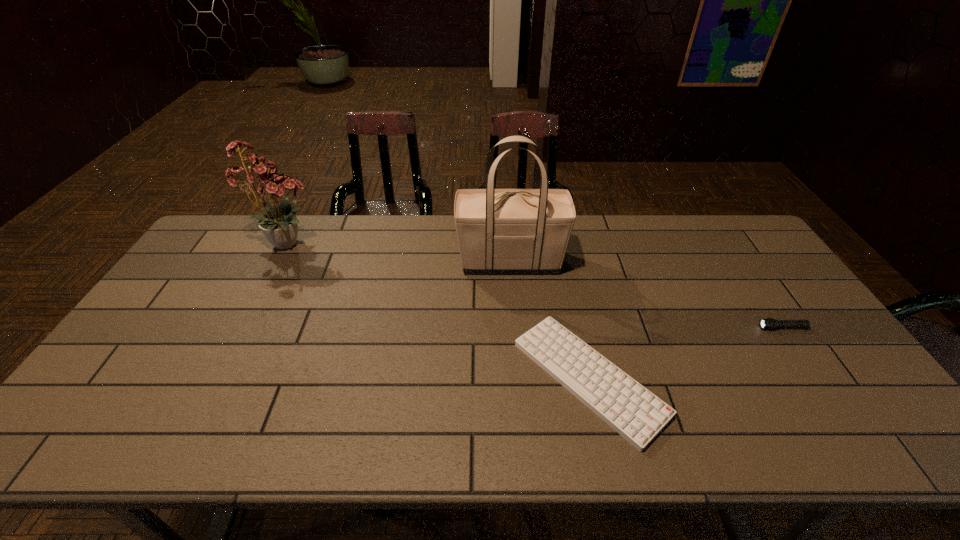
Find the location of a particular element. The width and height of the screenshot is (960, 540). empty location between the shopping bag and the rightmost object is located at coordinates (646, 295).

Locate an element on the screen. This screenshot has width=960, height=540. vacant space in between the computer keyboard and the flower arrangement is located at coordinates (440, 310).

You are a GUI agent. You are given a task and a screenshot of the screen. Output one action in this format:
    pyautogui.click(x=<x>, y=<y>)
    Task: Click on the free space between the computer keyboard and the rightmost object
    The width and height of the screenshot is (960, 540).
    Given the screenshot: What is the action you would take?
    pyautogui.click(x=685, y=353)

The width and height of the screenshot is (960, 540). I want to click on vacant point located between the leftmost object and the computer keyboard, so click(440, 310).

Identify which object is located as the second nearest to the flashlight. Please provide its 2D coordinates. Your answer should be formatted as a tuple, i.e. [(x, y)], where the tuple contains the x and y coordinates of a point satisfying the conditions above.

[(500, 231)]

Select which object is the second closest to the computer keyboard. Please provide its 2D coordinates. Your answer should be formatted as a tuple, i.e. [(x, y)], where the tuple contains the x and y coordinates of a point satisfying the conditions above.

[(769, 323)]

Find the location of a particular element. free space that satisfies the following two spatial constraints: 1. on the front-facing side of the flower arrangement; 2. on the back side of the computer keyboard is located at coordinates (219, 378).

Locate an element on the screen. The height and width of the screenshot is (540, 960). vacant space that satisfies the following two spatial constraints: 1. on the front-facing side of the leftmost object; 2. on the back side of the computer keyboard is located at coordinates (219, 378).

You are a GUI agent. You are given a task and a screenshot of the screen. Output one action in this format:
    pyautogui.click(x=<x>, y=<y>)
    Task: Click on the vacant position in the image that satisfies the following two spatial constraints: 1. with handles facing forward on the shopping bag; 2. on the back side of the computer keyboard
    Image resolution: width=960 pixels, height=540 pixels.
    Given the screenshot: What is the action you would take?
    pyautogui.click(x=519, y=378)